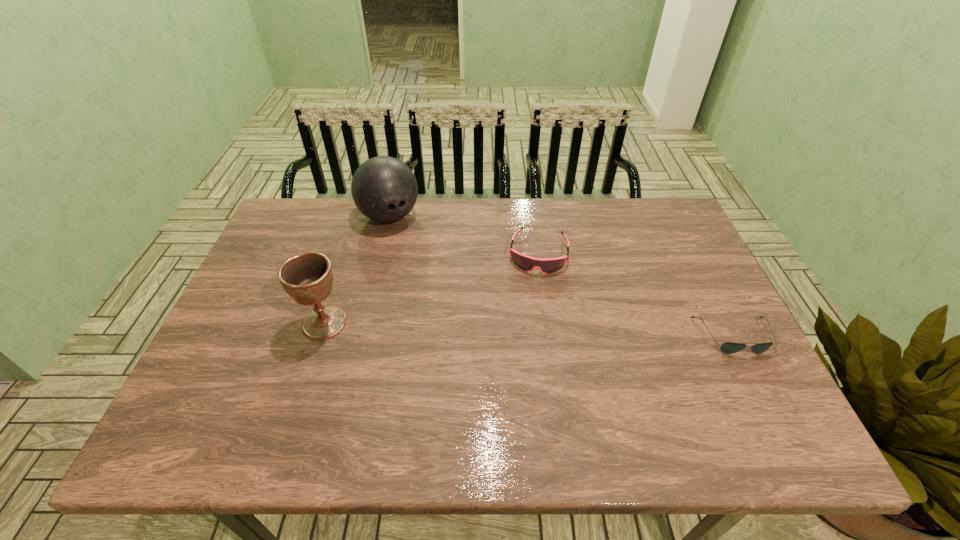
Image resolution: width=960 pixels, height=540 pixels. I want to click on vacant spot on the desktop that is between the chalice and the shortest object and is positioned on the front-facing side of the second shortest object, so click(527, 329).

Locate an element on the screen. vacant spot on the desktop that is between the chalice and the sunglasses and is positioned on the grip area of the bowling ball is located at coordinates (468, 328).